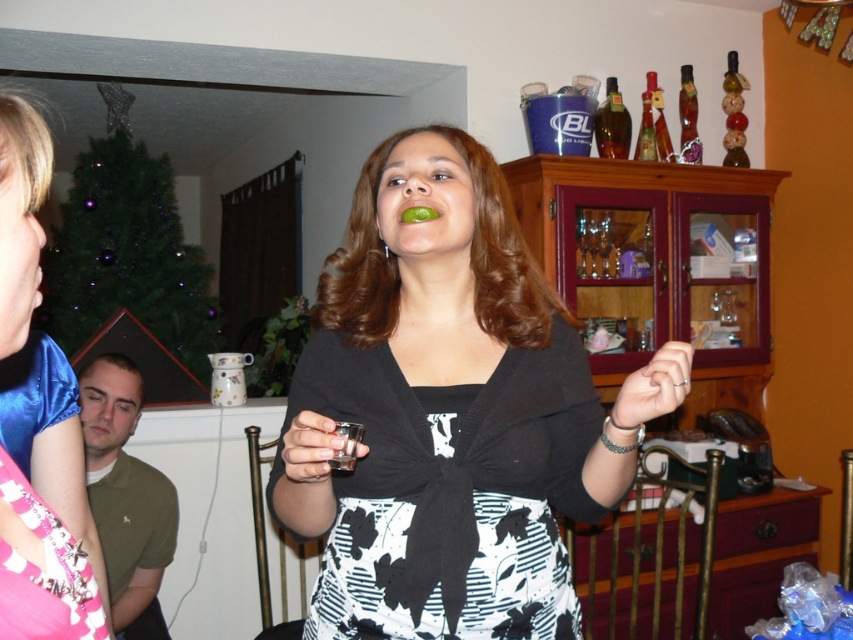
Based on the photo, you are at a party and see the translucent amber glass bottle at upper right and the green matte lime at center. Which object is positioned to the right side of the other?

The translucent amber glass bottle at upper right is to the right of the green matte lime at center.

You are a photographer setting up for a photoshoot. You need to position a light source so that it illuminates both the black matte dress at center and the translucent glass bottle at upper right. Considering their sizes, which object might require a closer light placement to ensure proper lighting?

The translucent glass bottle at upper right requires closer light placement because it is smaller than the black matte dress at center, which is much taller. A smaller object typically needs a closer light source to achieve adequate illumination.

You are a photographer setting up a camera. The camera is placed at the center of the scene. You need to adjust the focus so that both the black matte dress at center and the translucent glass bottle at upper right are in focus. The camera has a depth of field that can cover objects within a 1.5 meters range. Will both objects be in focus?

The black matte dress at center and the translucent glass bottle at upper right are 1.86 meters apart from each other. Since the depth of field can only cover 1.5 meters, the distance between them exceeds the coverage. Therefore, both objects cannot be in focus simultaneously.